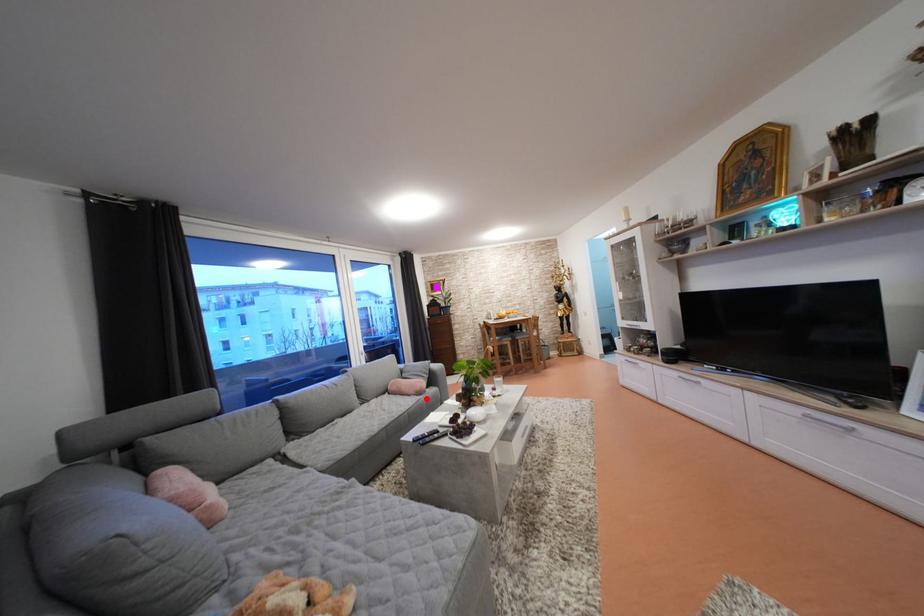
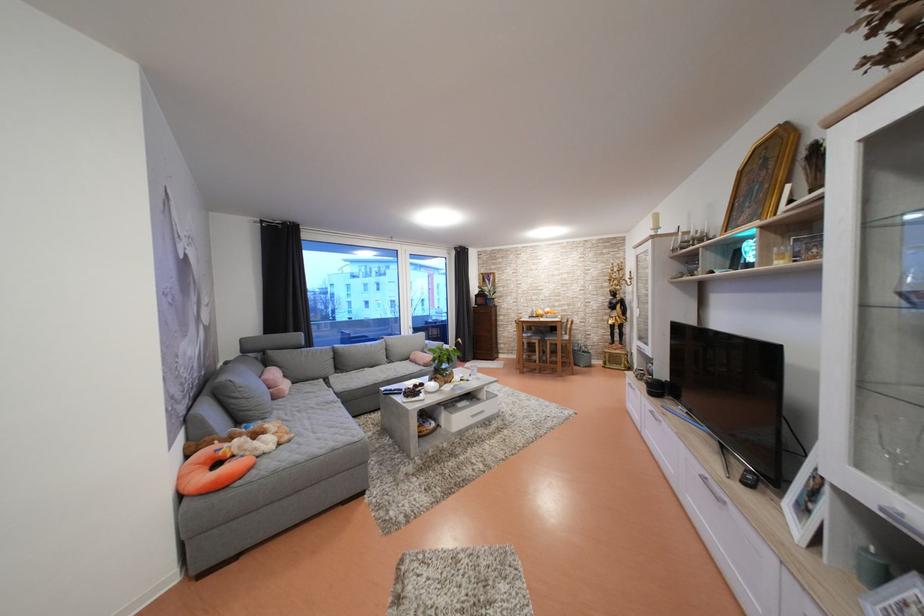
Question: I am providing you with two images of the same scene from different viewpoints. A red point is marked on the first image. Is the red point's position out of view in image 2?

Choices:
 (A) Yes
 (B) No

Answer: (B)